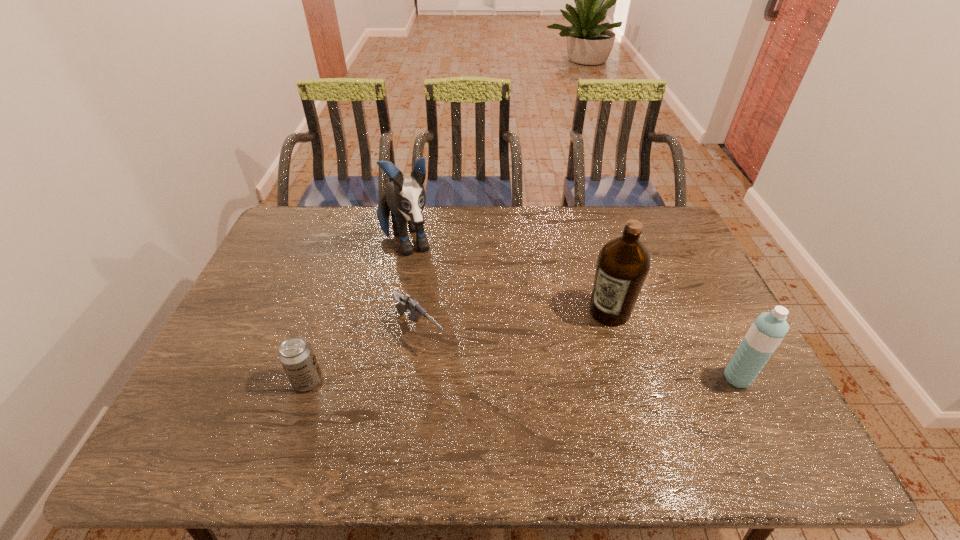
Locate an element on the screen. The height and width of the screenshot is (540, 960). beer can is located at coordinates (296, 355).

Where is `the fourth tallest object`? the fourth tallest object is located at coordinates (296, 355).

In order to click on the rightmost object in this screenshot , I will do `click(768, 330)`.

At what (x,y) coordinates should I click in order to perform the action: click on the third shortest object. Please return your answer as a coordinate pair (x, y). Image resolution: width=960 pixels, height=540 pixels. Looking at the image, I should click on (768, 330).

You are a GUI agent. You are given a task and a screenshot of the screen. Output one action in this format:
    pyautogui.click(x=<x>, y=<y>)
    Task: Click on the farthest object
    This screenshot has width=960, height=540.
    Given the screenshot: What is the action you would take?
    pyautogui.click(x=406, y=199)

I want to click on puppy, so click(406, 199).

You are a GUI agent. You are given a task and a screenshot of the screen. Output one action in this format:
    pyautogui.click(x=<x>, y=<y>)
    Task: Click on the gun
    
    Given the screenshot: What is the action you would take?
    pyautogui.click(x=406, y=303)

This screenshot has width=960, height=540. What are the coordinates of `the second tallest object` in the screenshot? It's located at [x=623, y=263].

Where is `olive oil`? olive oil is located at coordinates (623, 263).

I want to click on vacant space situated on the back of the beer can, so click(335, 300).